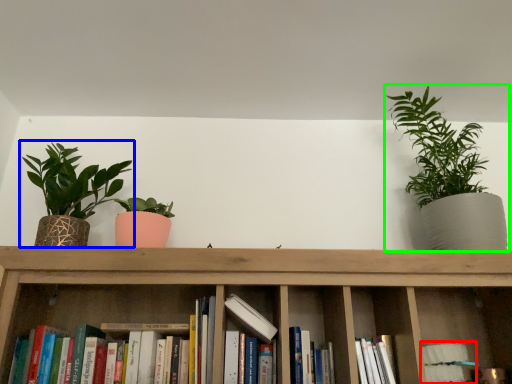
Question: Estimate the real-world distances between objects in this image. Which object is closer to book (highlighted by a red box), houseplant (highlighted by a blue box) or houseplant (highlighted by a green box)?

Choices:
 (A) houseplant
 (B) houseplant

Answer: (B)